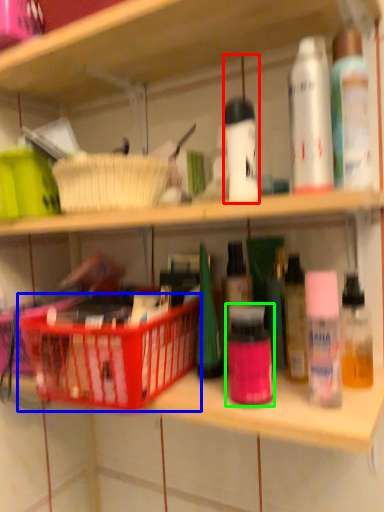
Question: Based on their relative distances, which object is farther from toiletry (highlighted by a red box)? Choose from basket (highlighted by a blue box) and toiletry (highlighted by a green box).

Choices:
 (A) basket
 (B) toiletry

Answer: (A)